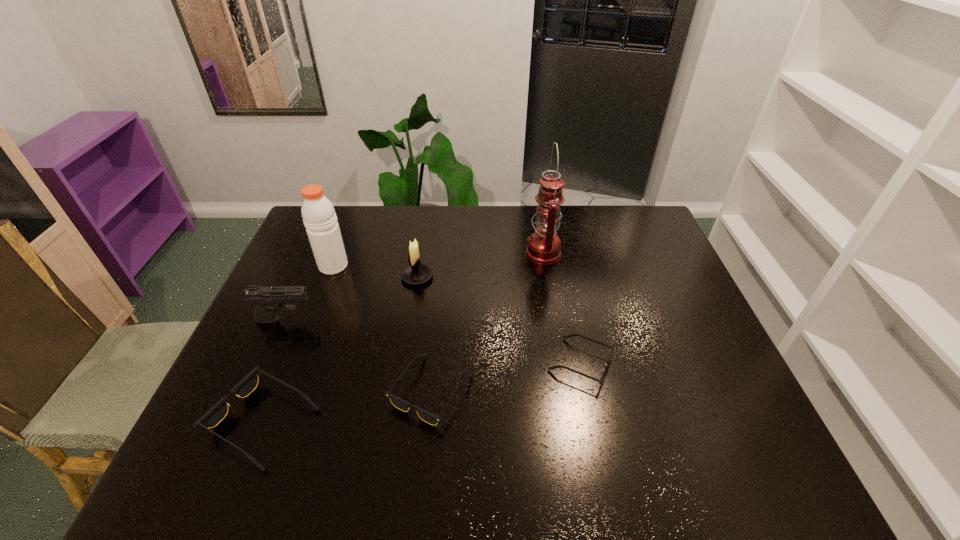
Identify the location of vacant place for an extra sunglasses on the right. The height and width of the screenshot is (540, 960). (715, 339).